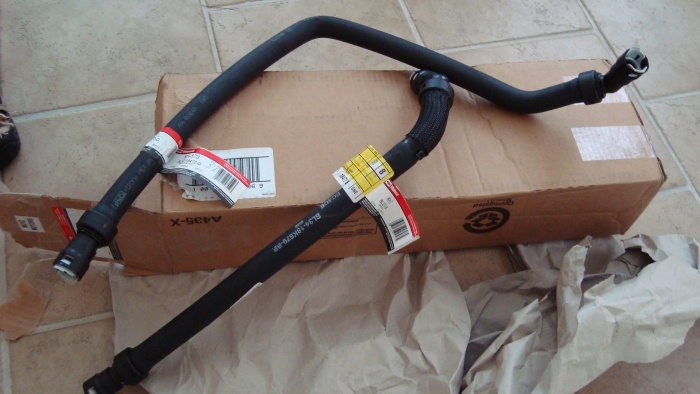
This screenshot has height=394, width=700. What are the coordinates of `tile floor` in the screenshot? It's located at (131, 21).